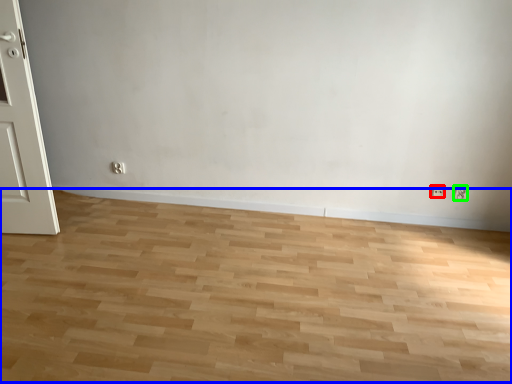
Question: Based on their relative distances, which object is farther from electric outlet (highlighted by a red box)? Choose from plain (highlighted by a blue box) and electric outlet (highlighted by a green box).

Choices:
 (A) plain
 (B) electric outlet

Answer: (A)